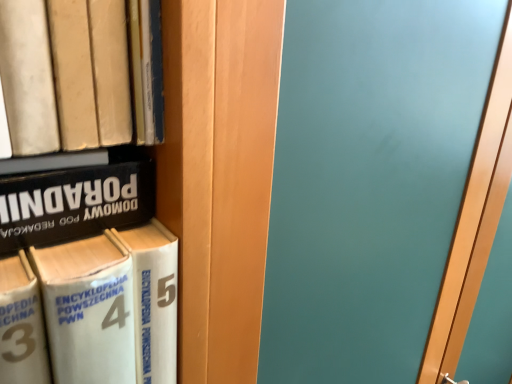
This screenshot has height=384, width=512. What are the coordinates of `black matte book at upper left` in the screenshot? It's located at (76, 200).

What is the approximate height of black matte book at upper left?

1.90 inches.

Measure the distance between point (36,227) and camera.

Point (36,227) is 11.57 inches away from camera.

Describe the element at coordinates (76, 200) in the screenshot. I see `black matte book at upper left` at that location.

Find the location of a particular element. This screenshot has width=512, height=384. black matte book at upper left is located at coordinates (76, 200).